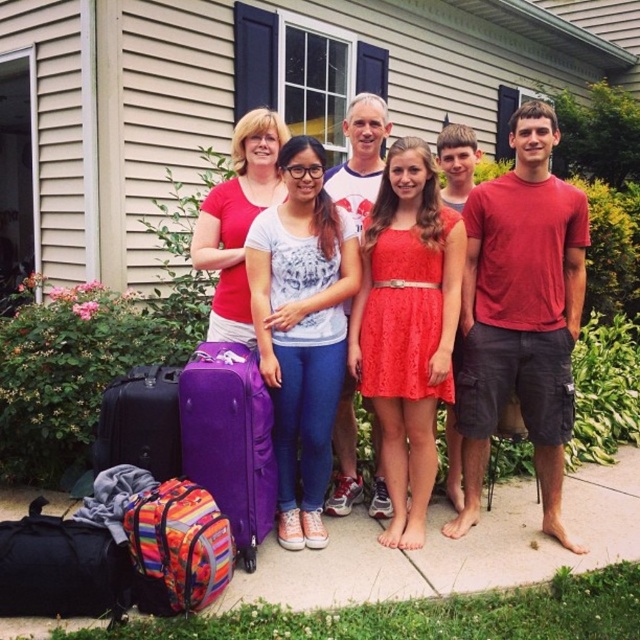
Does matte purple suitcase at left have a lesser width compared to matte purple suitcase at lower left?

No.

Can you confirm if matte purple suitcase at left is positioned to the right of matte purple suitcase at lower left?

Indeed, matte purple suitcase at left is positioned on the right side of matte purple suitcase at lower left.

This screenshot has width=640, height=640. Find the location of `matte purple suitcase at left`. matte purple suitcase at left is located at coordinates (520, 312).

Can you confirm if red cotton t-shirt at center is shorter than lace dress at center?

Incorrect, red cotton t-shirt at center's height does not fall short of lace dress at center's.

Where is `red cotton t-shirt at center`? red cotton t-shirt at center is located at coordinates (522, 314).

At what (x,y) coordinates should I click in order to perform the action: click on red cotton t-shirt at center. Please return your answer as a coordinate pair (x, y). Looking at the image, I should click on (522, 314).

Is point (429, 380) behind point (214, 230)?

No, (429, 380) is closer to viewer.

Who is more distant from viewer, (448, 316) or (284, 189)?

The point (284, 189) is more distant.

Locate an element on the screen. This screenshot has width=640, height=640. lace dress at center is located at coordinates (406, 326).